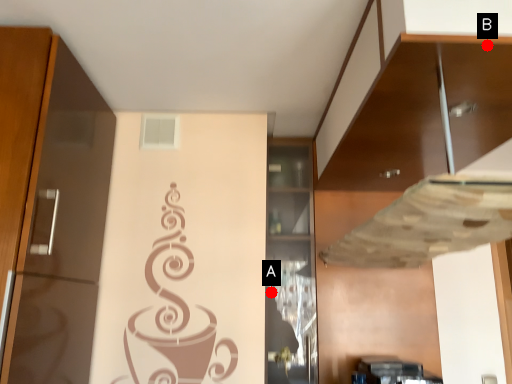
Question: Two points are circled on the image, labeled by A and B beside each circle. Which point appears farthest from the camera in this image?

Choices:
 (A) A is further
 (B) B is further

Answer: (A)